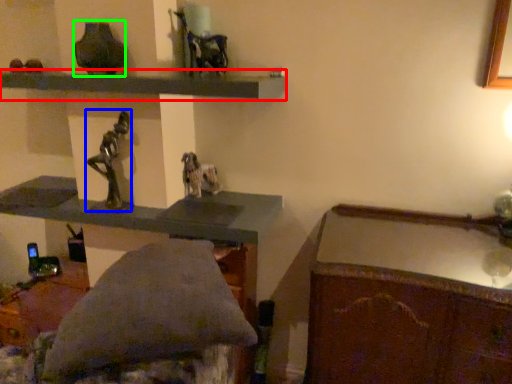
Question: Considering the real-world distances, which object is farthest from shelf (highlighted by a red box)? figurine (highlighted by a blue box) or vase (highlighted by a green box)?

Choices:
 (A) figurine
 (B) vase

Answer: (A)